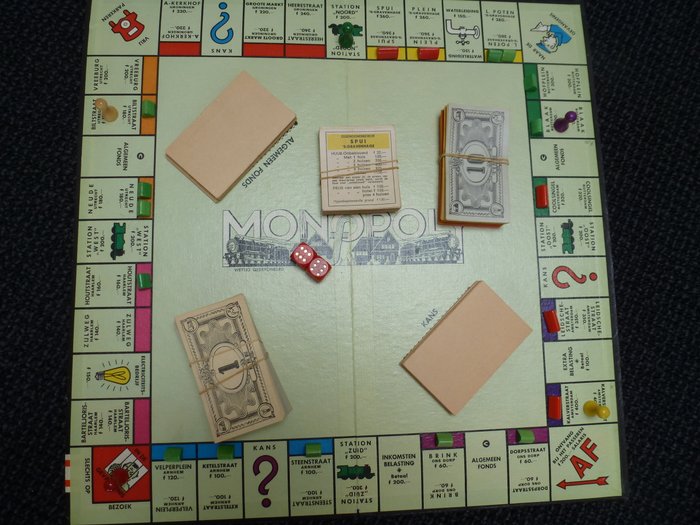
This screenshot has width=700, height=525. I want to click on hotels, so click(384, 52), click(430, 55), click(540, 194), click(556, 328), click(560, 408).